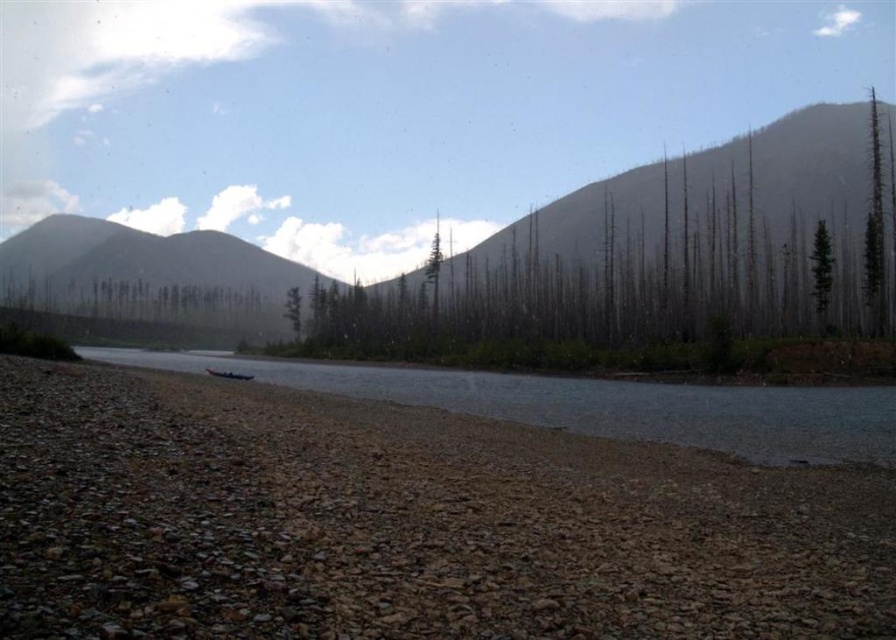
I want to click on green matte tree at right, so click(x=821, y=273).

Is the position of green matte tree at right less distant than that of blue plastic boat at lower center?

No.

Where is `green matte tree at right`? This screenshot has width=896, height=640. green matte tree at right is located at coordinates (821, 273).

Does dead wood at center appear under clear water at center?

Actually, dead wood at center is above clear water at center.

Does dead wood at center have a greater height compared to clear water at center?

Yes.

Measure the distance between dead wood at center and camera.

dead wood at center is 175.62 meters from camera.

This screenshot has width=896, height=640. In order to click on dead wood at center in this screenshot , I will do `click(636, 259)`.

In the scene shown: Can you confirm if brown gravel at lower left is positioned to the left of green textured tree at right?

Yes, brown gravel at lower left is to the left of green textured tree at right.

Who is more forward, [703,529] or [875,273]?

Point [703,529] is more forward.

You are a GUI agent. You are given a task and a screenshot of the screen. Output one action in this format:
    pyautogui.click(x=<x>, y=<y>)
    Task: Click on the brown gravel at lower left
    This screenshot has height=640, width=896.
    Given the screenshot: What is the action you would take?
    pyautogui.click(x=403, y=524)